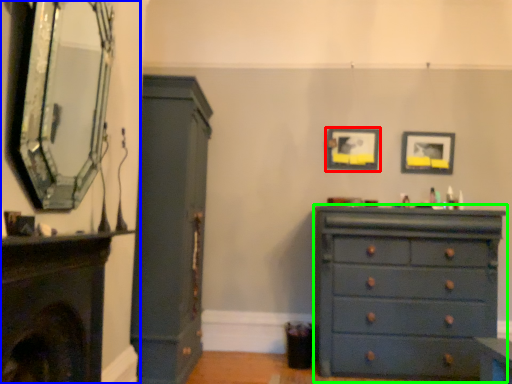
Question: Considering the real-world distances, which object is closest to picture frame (highlighted by a red box)? fireplace (highlighted by a blue box) or chest of drawers (highlighted by a green box).

Choices:
 (A) fireplace
 (B) chest of drawers

Answer: (B)